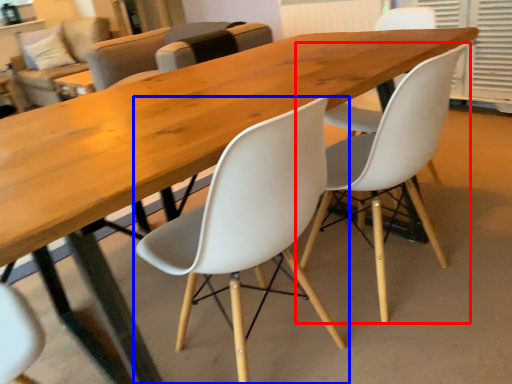
Question: Which point is further to the camera, chair (highlighted by a red box) or chair (highlighted by a blue box)?

Choices:
 (A) chair
 (B) chair

Answer: (A)